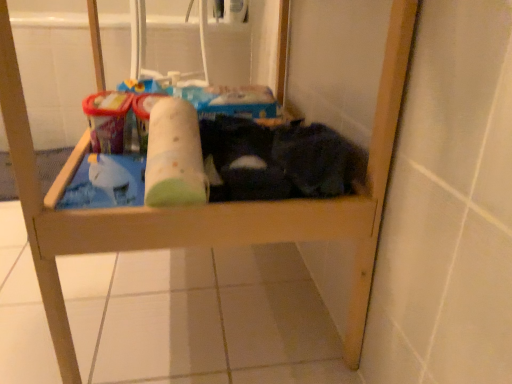
Question: Based on their sizes in the image, would you say green fabric toilet paper at center is bigger or smaller than dark fabric laundry at lower right?

Choices:
 (A) small
 (B) big

Answer: (A)

Question: From a real-world perspective, is green fabric toilet paper at center physically located above or below dark fabric laundry at lower right?

Choices:
 (A) above
 (B) below

Answer: (A)

Question: Is green fabric toilet paper at center to the left or to the right of dark fabric laundry at lower right in the image?

Choices:
 (A) right
 (B) left

Answer: (B)

Question: From their relative heights in the image, would you say dark fabric laundry at lower right is taller or shorter than green fabric toilet paper at center?

Choices:
 (A) short
 (B) tall

Answer: (B)

Question: From the image's perspective, is dark fabric laundry at lower right located above or below green fabric toilet paper at center?

Choices:
 (A) below
 (B) above

Answer: (B)

Question: Is point (321, 145) positioned closer to the camera than point (199, 175)?

Choices:
 (A) closer
 (B) farther

Answer: (B)

Question: In the image, is dark fabric laundry at lower right positioned in front of or behind green fabric toilet paper at center?

Choices:
 (A) behind
 (B) front

Answer: (A)